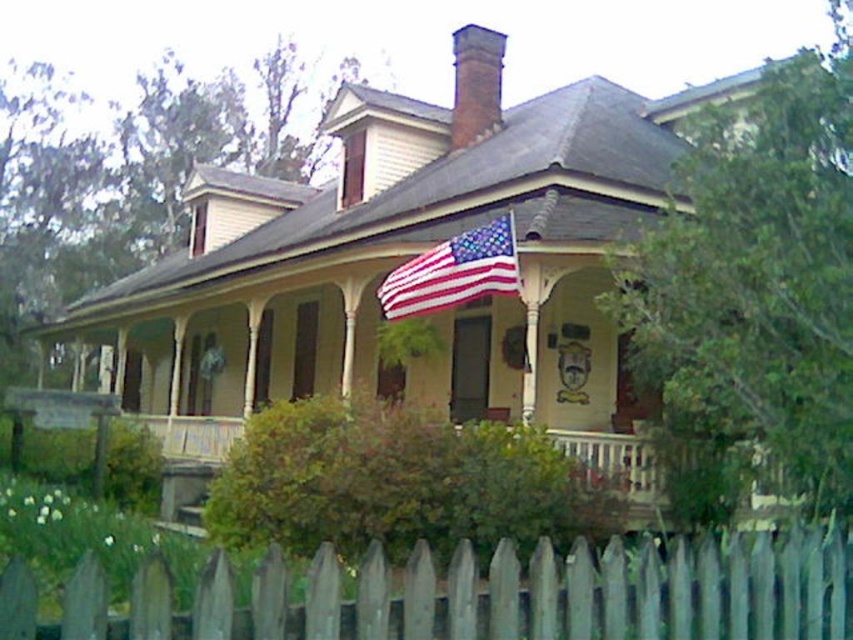
You are a painter hired to paint the gray wooden fence at lower center and the american flag at center. You need to know which object requires more paint based on their widths. Which one needs more paint?

The gray wooden fence at lower center requires more paint because its width is larger than the american flag at center.

You are standing on the front lawn of the two story house and see the point at coordinates (480, 595). What object is located at that point?

The point at coordinates (480, 595) marks the gray wooden fence at lower center.

You are standing at point (645,582) and want to walk to the front door of the house. The house is 10 feet wide. Can you reach the door without crossing the 10.51 feet distance?

Yes, because the distance between you and the door is 10.51 feet, which is slightly more than the house width of 10 feet, but since you can walk directly towards the door, you can reach it within the given distance.